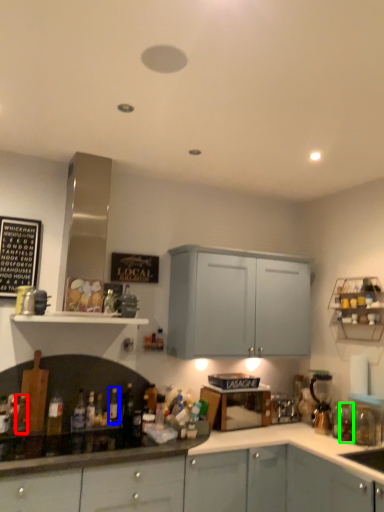
Question: Estimate the real-world distances between objects in this image. Which object is farther from bottle (highlighted by a red box), bottle (highlighted by a blue box) or bottle (highlighted by a green box)?

Choices:
 (A) bottle
 (B) bottle

Answer: (B)